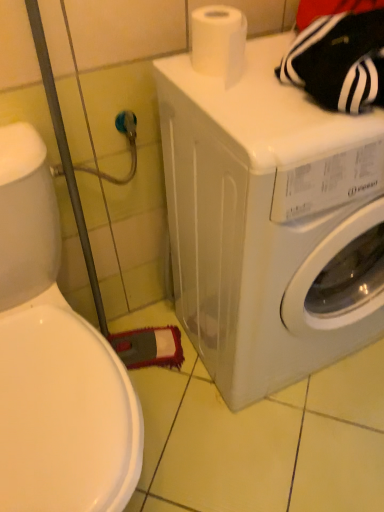
Identify the location of vacant area to the right of white matte toilet paper at upper center. point(279,77).